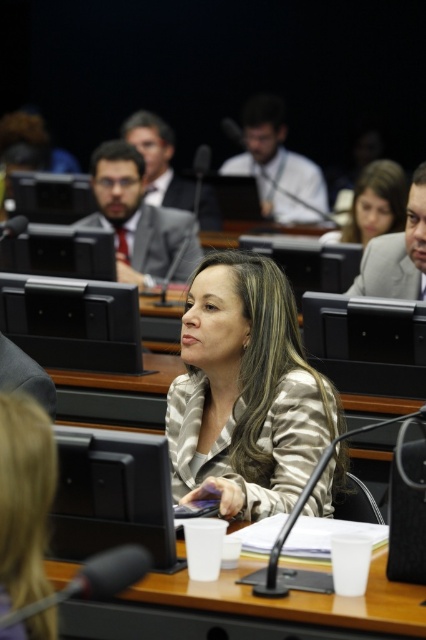
You are a photographer in the conference room. You need to capture a photo of the silky beige blazer at center and the black plastic monitor at center. Which object should you focus on first if you want to ensure both are in focus without adjusting the camera settings?

The silky beige blazer at center is located above the black plastic monitor at center. Since they are at different heights, you should focus on the black plastic monitor at center first, as it is closer to the camera, and the silky beige blazer at center will naturally be in focus due to its position above.

You are a person who is 6 feet tall standing in the conference room. You see the silky beige blazer at center and the black plastic monitor at center. How far apart are these two items?

The distance between the silky beige blazer at center and the black plastic monitor at center is 18.87 inches.

You are an interior designer assessing the layout of this conference room. You need to determine if the black plastic monitor at center can be placed on a shelf that is designed to accommodate items narrower than the matte gray suit at upper left. Can the monitor fit based on their widths?

The black plastic monitor at center has a lesser width compared to the matte gray suit at upper left, so it can fit on the shelf designed for items narrower than the matte gray suit at upper left.